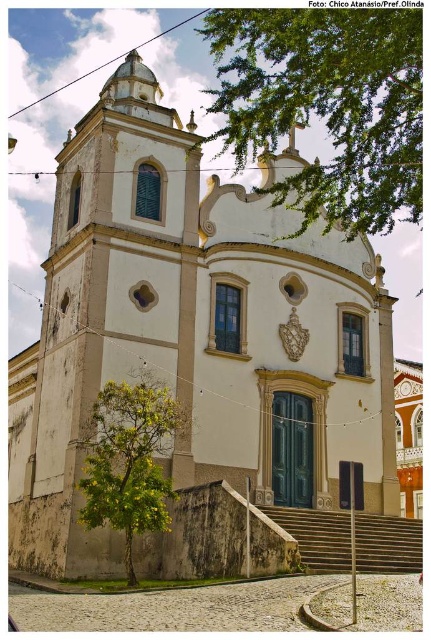
Between green leafy tree at upper center and stone steps at center, which one appears on the right side from the viewer's perspective?

Positioned to the right is stone steps at center.

Is green leafy tree at upper center wider than stone steps at center?

Correct, the width of green leafy tree at upper center exceeds that of stone steps at center.

Who is more distant from viewer, (x=305, y=33) or (x=362, y=528)?

The point (x=362, y=528) is behind.

You are a GUI agent. You are given a task and a screenshot of the screen. Output one action in this format:
    pyautogui.click(x=<x>, y=<y>)
    Task: Click on the green leafy tree at upper center
    The width and height of the screenshot is (431, 640).
    Given the screenshot: What is the action you would take?
    pyautogui.click(x=325, y=106)

Is point (99, 433) more distant than point (390, 524)?

No, (99, 433) is closer to viewer.

Is green leafy tree at lower left behind stone steps at center?

No, green leafy tree at lower left is closer to the viewer.

I want to click on green leafy tree at lower left, so (x=128, y=460).

Can you confirm if green leafy tree at upper center is positioned to the right of green leafy tree at lower left?

Correct, you'll find green leafy tree at upper center to the right of green leafy tree at lower left.

Is green leafy tree at upper center smaller than green leafy tree at lower left?

Incorrect, green leafy tree at upper center is not smaller in size than green leafy tree at lower left.

Identify the location of green leafy tree at upper center. (325, 106).

At what (x,y) coordinates should I click in order to perform the action: click on green leafy tree at upper center. Please return your answer as a coordinate pair (x, y). This screenshot has height=640, width=431. Looking at the image, I should click on (325, 106).